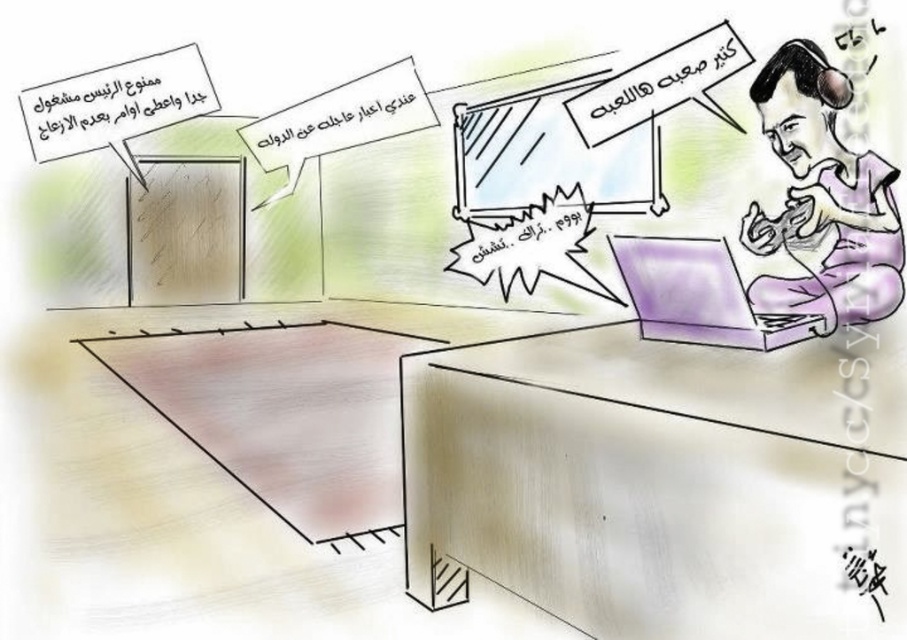
Question: Which object is closer to the camera taking this photo?

Choices:
 (A) green paper sign at upper left
 (B) purple matte laptop at right

Answer: (B)

Question: Which point appears farthest from the camera in this image?

Choices:
 (A) (798, 157)
 (B) (423, 106)
 (C) (720, 60)

Answer: (B)

Question: Can you confirm if white paper sign at upper center is positioned above white paper sign at upper right?

Choices:
 (A) no
 (B) yes

Answer: (B)

Question: Which of these objects is positioned closest to the green paper sign at upper left?

Choices:
 (A) purple matte laptop at right
 (B) white paper sign at upper center
 (C) purple matte shirt at upper right
 (D) white paper sign at upper right

Answer: (B)

Question: Can you confirm if purple matte shirt at upper right is positioned above white paper sign at upper center?

Choices:
 (A) no
 (B) yes

Answer: (A)

Question: Is green paper sign at upper left positioned at the back of white paper sign at upper center?

Choices:
 (A) yes
 (B) no

Answer: (B)